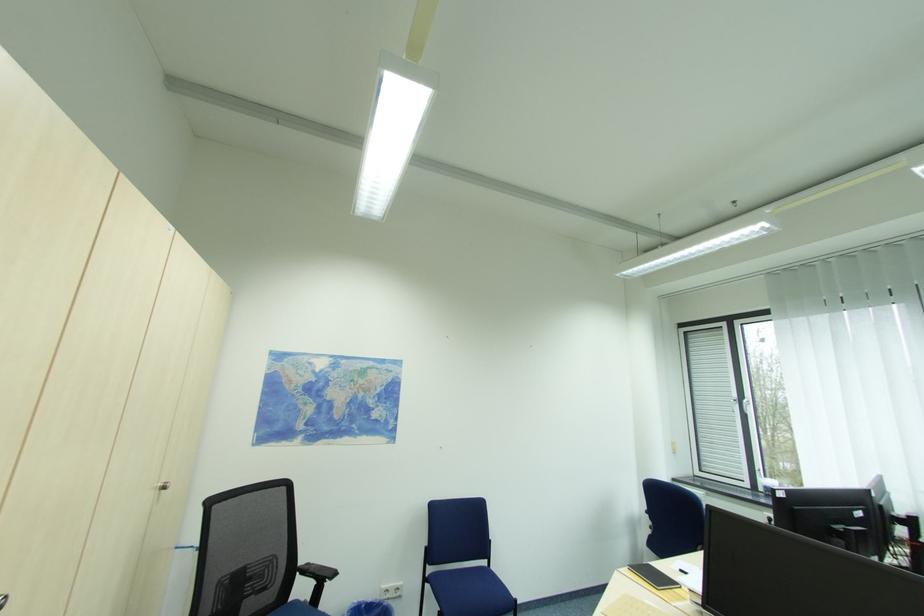
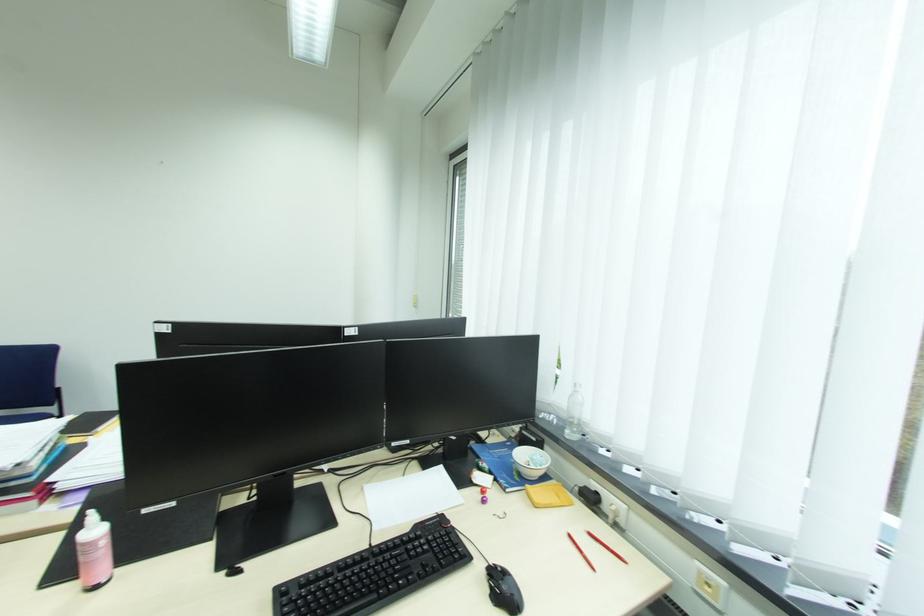
Question: What movement of the cameraman would produce the second image?

Choices:
 (A) Left
 (B) Right
 (C) Forward
 (D) Backward

Answer: (B)